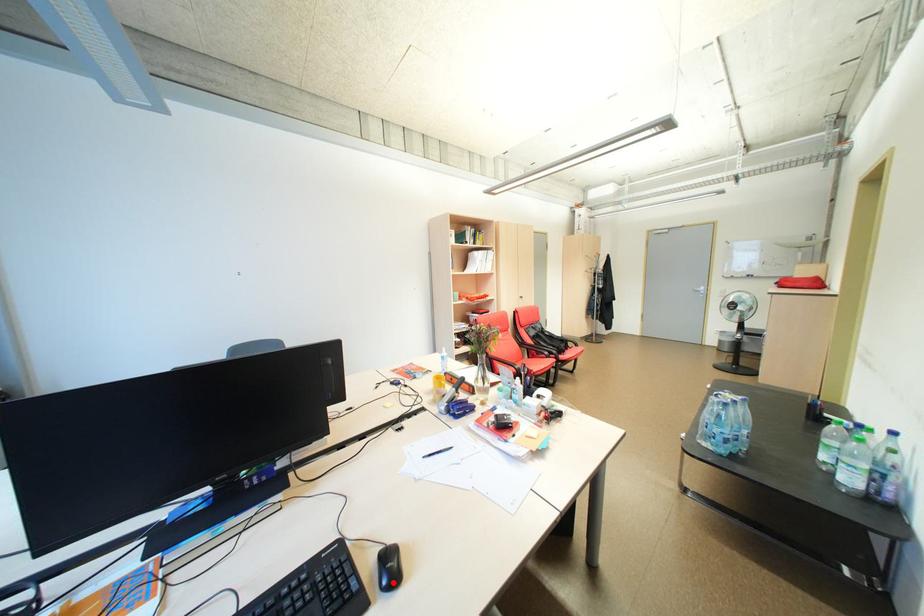
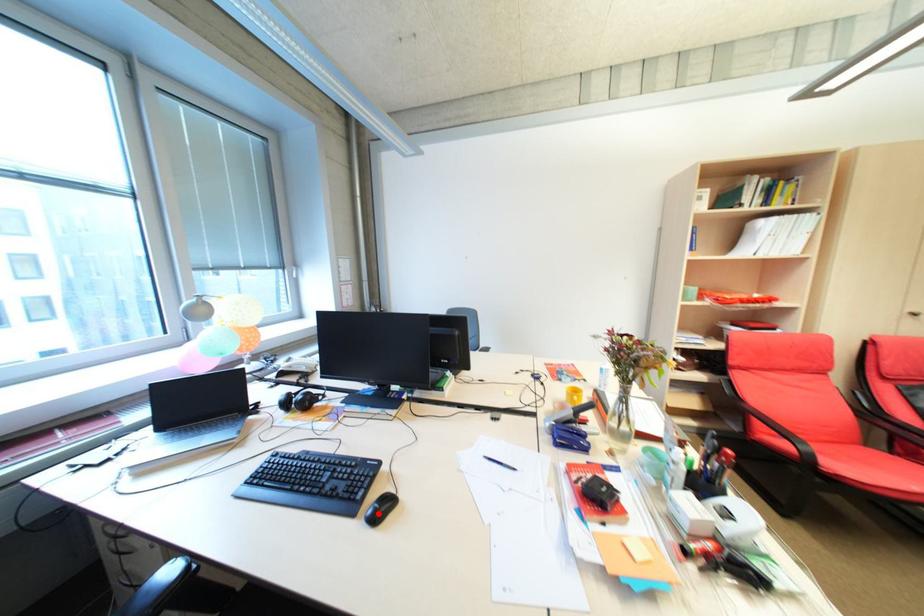
I am providing you with two images of the same scene from different viewpoints. A red point is marked on the first image and another point is marked on the second image. Are the points marked in image1 and image2 representing the same 3D position?

Yes